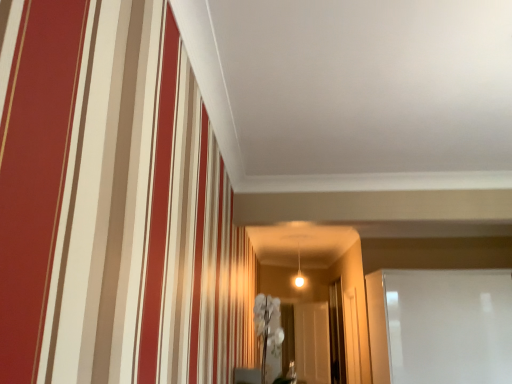
Question: Considering the positions of transparent glass door at center, which appears as the first glass door when viewed from the left, and transparent glass door at center, the second glass door from the right, in the image, is transparent glass door at center, which appears as the first glass door when viewed from the left, taller or shorter than transparent glass door at center, the second glass door from the right,?

Choices:
 (A) short
 (B) tall

Answer: (A)

Question: From a real-world perspective, is transparent glass door at center, which appears as the third glass door when viewed from the right, physically located above or below transparent glass door at center, placed as the second glass door when sorted from front to back?

Choices:
 (A) above
 (B) below

Answer: (B)

Question: Which is nearer to the white glossy glass door at right, the first glass door when ordered from front to back?

Choices:
 (A) transparent glass door at center, the 2th glass door viewed from the back
 (B) transparent glass door at center, marked as the third glass door in a front-to-back arrangement

Answer: (A)

Question: Which of these objects is positioned farthest from the white glossy glass door at right, the first glass door when ordered from front to back?

Choices:
 (A) transparent glass door at center, which appears as the third glass door when viewed from the right
 (B) transparent glass door at center, the 2th glass door viewed from the back

Answer: (A)